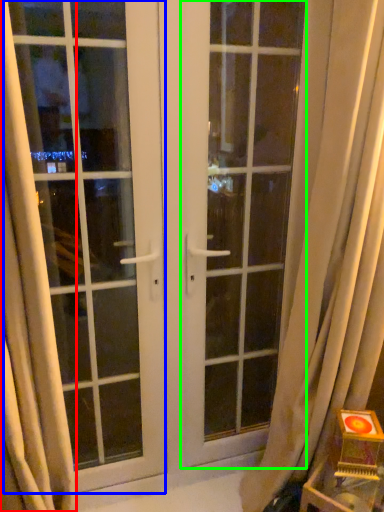
Question: Which object is positioned closest to curtain (highlighted by a red box)? Select from window (highlighted by a blue box) and screen door (highlighted by a green box).

Choices:
 (A) window
 (B) screen door

Answer: (A)